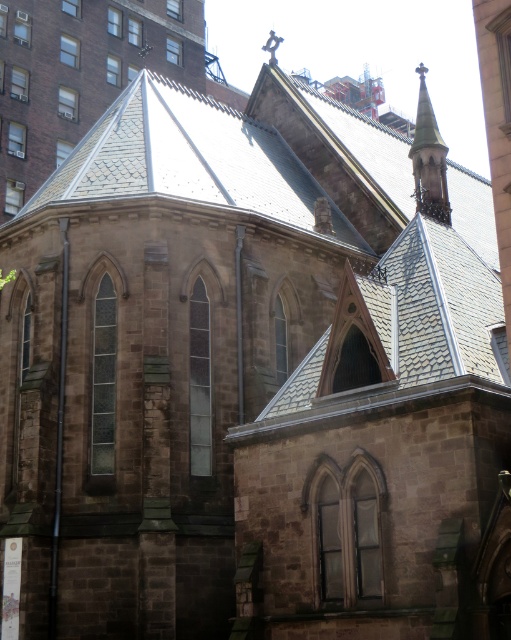
Does gray slate roof at upper center have a greater width compared to smooth stone spire at upper right?

Correct, the width of gray slate roof at upper center exceeds that of smooth stone spire at upper right.

Who is shorter, gray slate roof at upper center or smooth stone spire at upper right?

gray slate roof at upper center

In order to click on gray slate roof at upper center in this screenshot , I will do `click(182, 157)`.

Identify the location of gray slate roof at upper center. (182, 157).